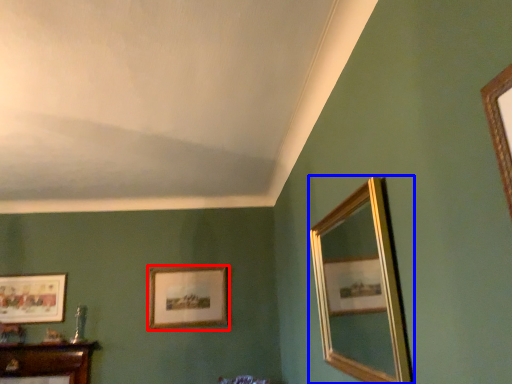
Question: Among these objects, which one is nearest to the camera, picture frame (highlighted by a red box) or mirror (highlighted by a blue box)?

Choices:
 (A) picture frame
 (B) mirror

Answer: (B)